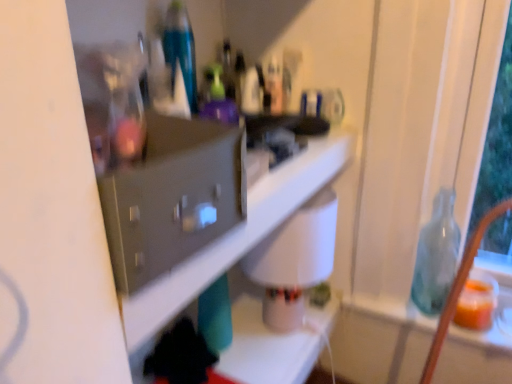
Question: Considering the positions of white glossy shelf at center and translucent glass bottle at right in the image, is white glossy shelf at center wider or thinner than translucent glass bottle at right?

Choices:
 (A) thin
 (B) wide

Answer: (B)

Question: Considering their positions, is white glossy shelf at center located in front of or behind translucent glass bottle at right?

Choices:
 (A) behind
 (B) front

Answer: (B)

Question: Is white glossy shelf at center spatially inside translucent glass bottle at right, or outside of it?

Choices:
 (A) inside
 (B) outside

Answer: (B)

Question: Considering the positions of translucent glass bottle at right and white glossy shelf at center in the image, is translucent glass bottle at right taller or shorter than white glossy shelf at center?

Choices:
 (A) short
 (B) tall

Answer: (B)

Question: From a real-world perspective, is translucent glass bottle at right above or below white glossy shelf at center?

Choices:
 (A) below
 (B) above

Answer: (A)

Question: Looking at the image, does translucent glass bottle at right seem bigger or smaller compared to white glossy shelf at center?

Choices:
 (A) big
 (B) small

Answer: (B)

Question: In the image, is translucent glass bottle at right positioned in front of or behind white glossy shelf at center?

Choices:
 (A) front
 (B) behind

Answer: (B)